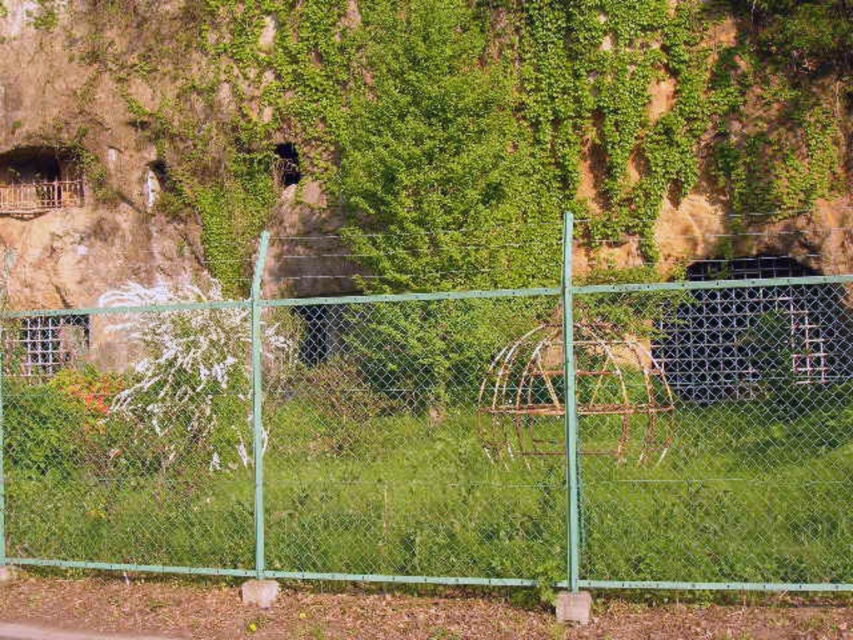
You are standing at the point marked as point [448,436] in the image. What object are you currently standing on?

The point [448,436] is on the green chain link fence at center, so you are standing on the green chain link fence at center.